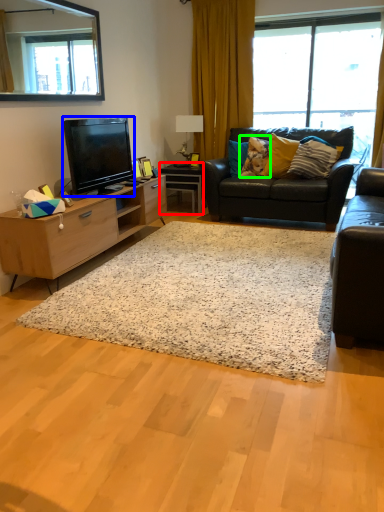
Question: Which object is the farthest from desk (highlighted by a red box)? Choose among these: television (highlighted by a blue box) or pillow (highlighted by a green box).

Choices:
 (A) television
 (B) pillow

Answer: (A)